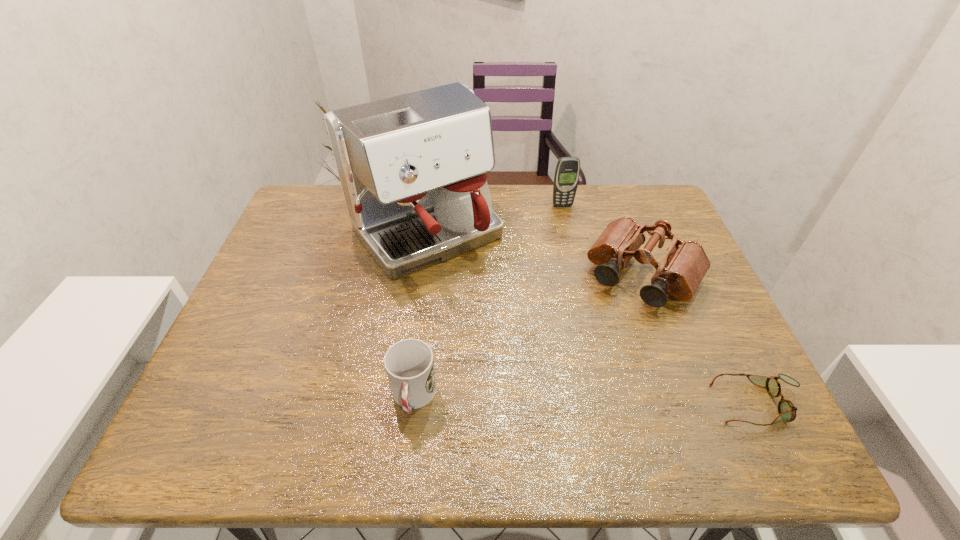
Locate an element on the screen. This screenshot has height=540, width=960. free space on the desktop that is between the cup and the shortest object and is positioned on the screen of the second tallest object is located at coordinates (629, 401).

Locate an element on the screen. This screenshot has width=960, height=540. free spot on the desktop that is between the cup and the shortest object and is positioned through the eyepieces of the third shortest object is located at coordinates (563, 400).

I want to click on free space on the desktop that is between the fourth tallest object and the shortest object and is positioned on the front of the tallest object near the spout, so click(x=559, y=400).